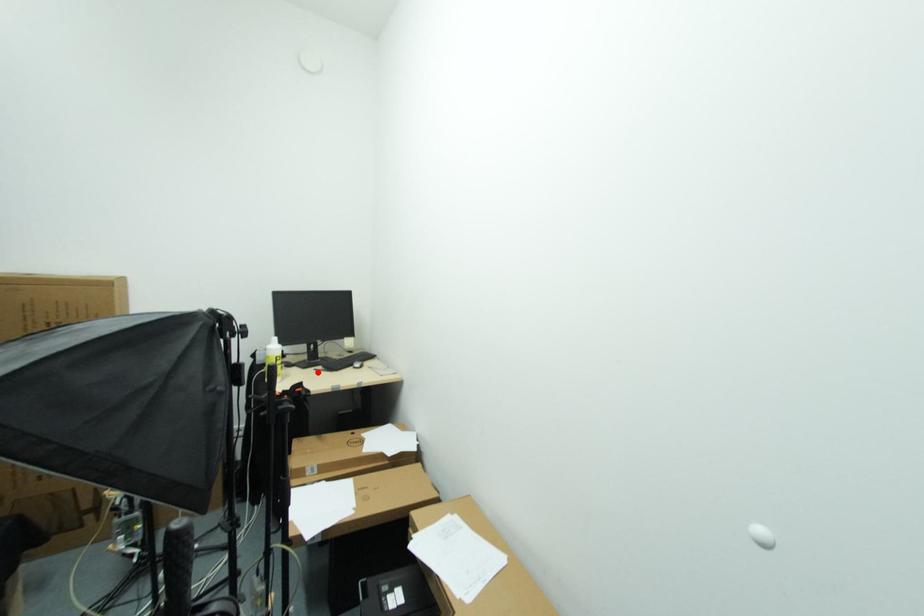
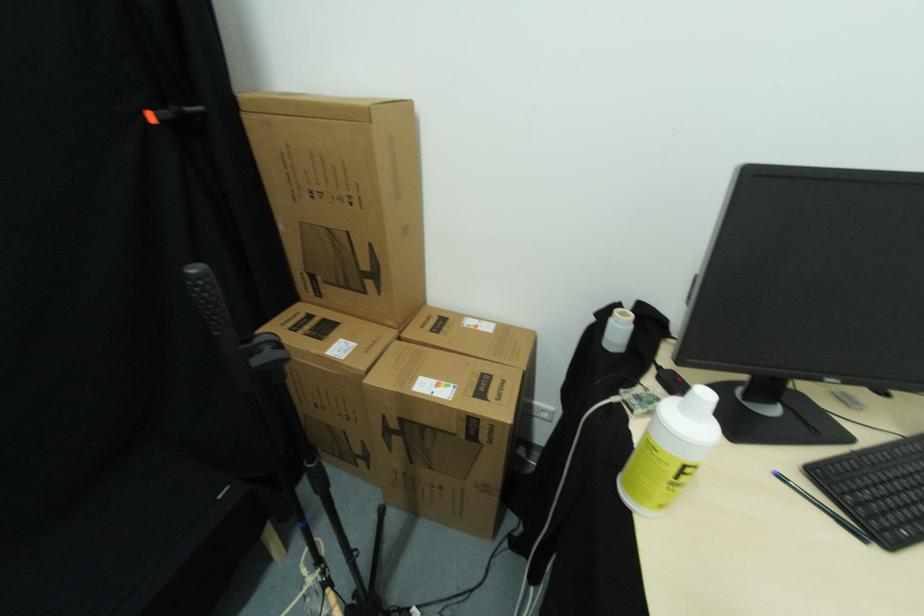
Locate, in the second image, the point that corresponds to the highlighted location in the first image.

(784, 479)